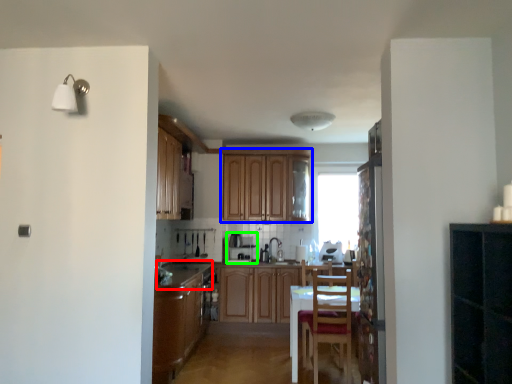
Question: Based on their relative distances, which object is farther from counter top (highlighted by a red box)? Choose from cabinetry (highlighted by a blue box) and appliance (highlighted by a green box).

Choices:
 (A) cabinetry
 (B) appliance

Answer: (A)